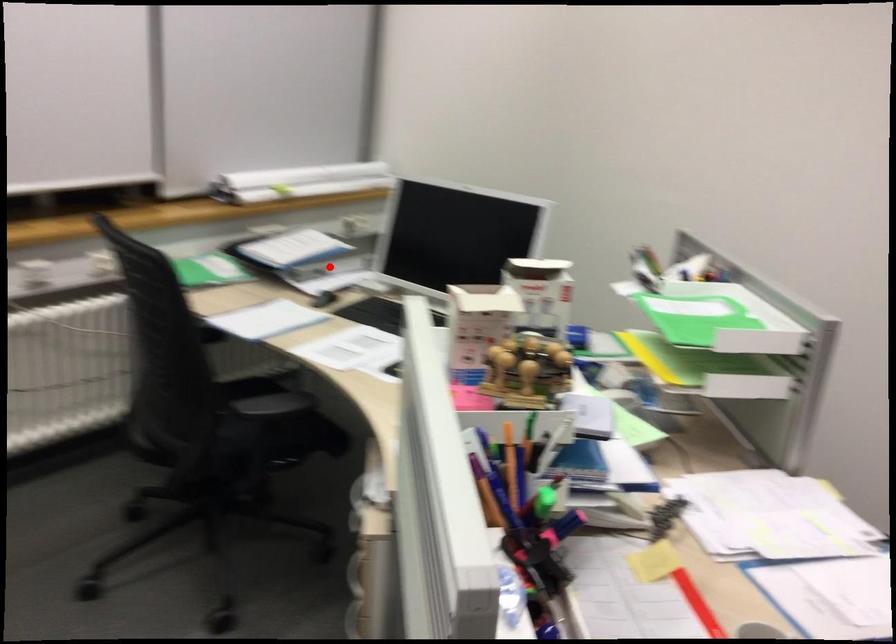
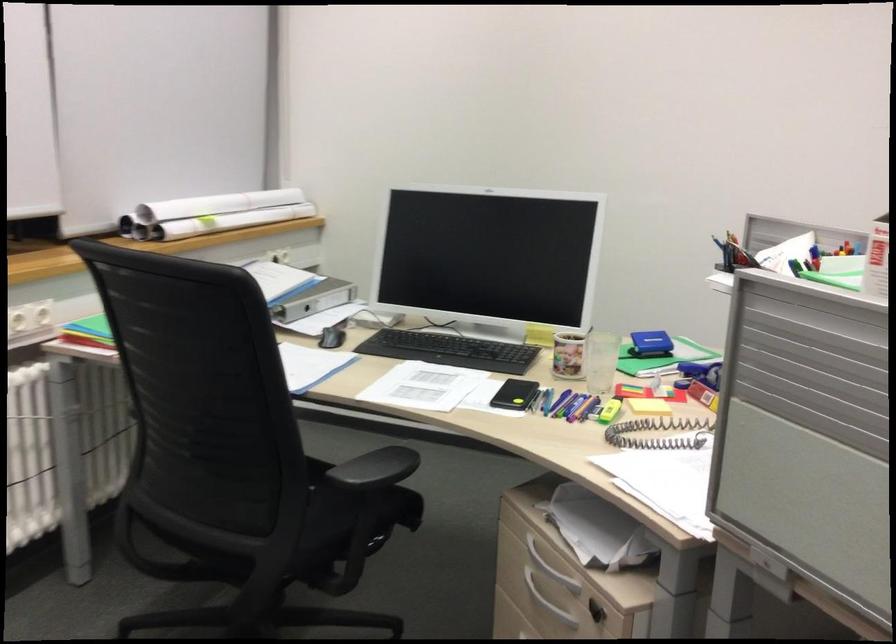
The point at the highlighted location is marked in the first image. Where is the corresponding point in the second image?

(314, 299)